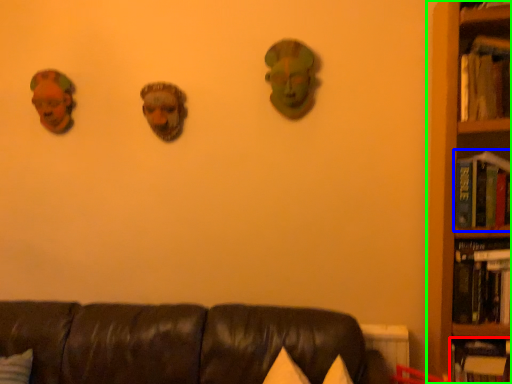
Question: Estimate the real-world distances between objects in this image. Which object is closer to book (highlighted by a red box), book (highlighted by a blue box) or bookcase (highlighted by a green box)?

Choices:
 (A) book
 (B) bookcase

Answer: (B)